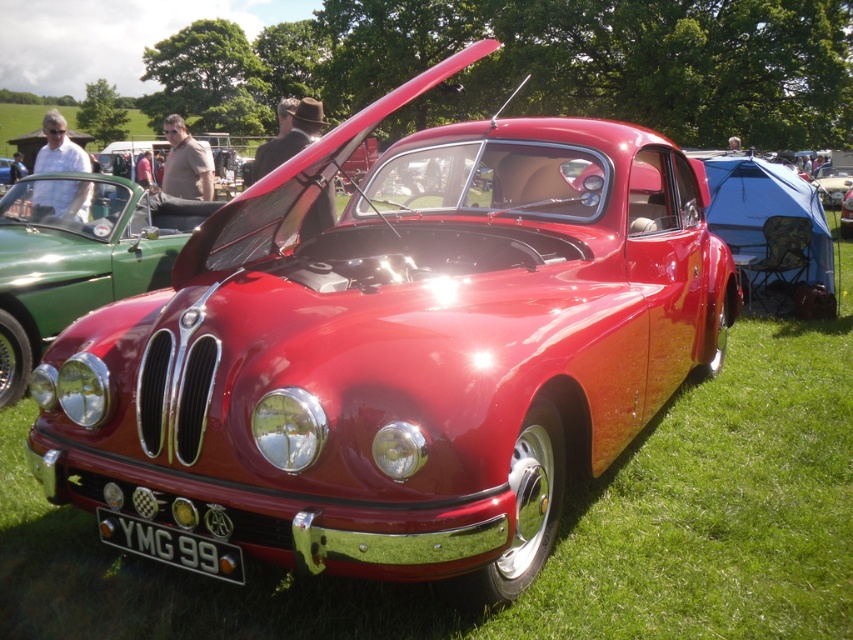
Is shiny chrome grille at center positioned before shiny red car at center?

Yes, it is in front of shiny red car at center.

In the scene shown: Does shiny chrome grille at center have a lesser width compared to shiny red car at center?

Incorrect, shiny chrome grille at center's width is not less than shiny red car at center's.

Between point (39, 216) and point (839, 230), which one is positioned behind?

The point (839, 230) is behind.

Find the location of a particular element. shiny chrome grille at center is located at coordinates (77, 257).

Does black metallic license plate at center have a lesser height compared to shiny red car at center?

Yes.

Does black metallic license plate at center have a larger size compared to shiny red car at center?

Incorrect, black metallic license plate at center is not larger than shiny red car at center.

This screenshot has width=853, height=640. Describe the element at coordinates (170, 545) in the screenshot. I see `black metallic license plate at center` at that location.

At what (x,y) coordinates should I click in order to perform the action: click on black metallic license plate at center. Please return your answer as a coordinate pair (x, y). Looking at the image, I should click on (170, 545).

How distant is black metallic license plate at center from matte black car at center?

Answer: They are 98.93 feet apart.

Who is positioned more to the left, black metallic license plate at center or matte black car at center?

From the viewer's perspective, matte black car at center appears more on the left side.

You are a GUI agent. You are given a task and a screenshot of the screen. Output one action in this format:
    pyautogui.click(x=<x>, y=<y>)
    Task: Click on the black metallic license plate at center
    The height and width of the screenshot is (640, 853).
    Given the screenshot: What is the action you would take?
    pyautogui.click(x=170, y=545)